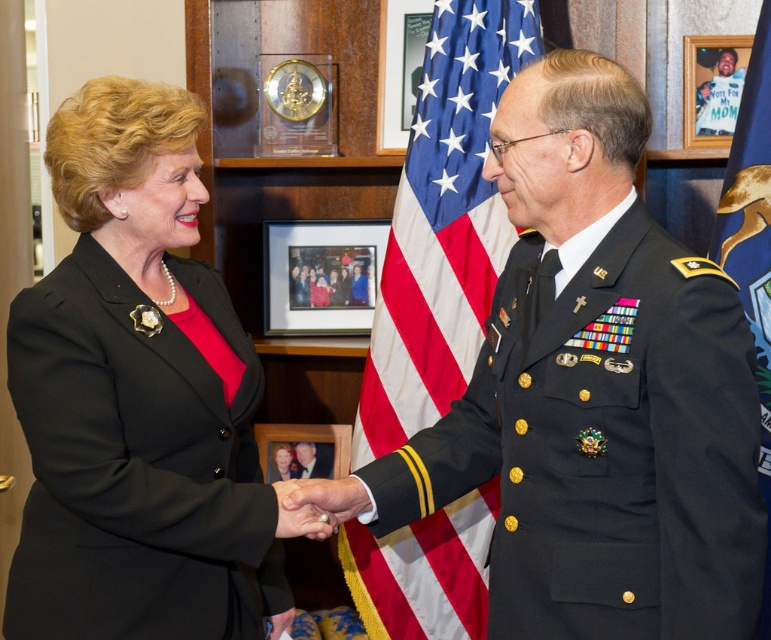
You are a photographer who needs to capture a closeup of the blue fabric flag at right. Based on the scene description, where should you position yourself to ensure the flag is in the frame?

The blue fabric flag at right is located at point (752,243), so you should position yourself to the right side of the scene to capture it in the frame.

You are a photographer adjusting your camera settings. You need to focus on two specific points in the image, point (x=514, y=67) and point (x=305, y=314). Which point should you adjust the focus for first if you want to capture the closest object to the camera?

Point (x=514, y=67) is closer to the camera than point (x=305, y=314), so you should focus on point (x=514, y=67) first to capture the closest object.

You are an event planner organizing a ceremony and need to place a new decorative item between the blue fabric flag at right and the wooden framed photo at center. Based on their current positions, which object should the new item be placed closer to?

The blue fabric flag at right is positioned on the right side of the wooden framed photo at center. Therefore, the new item should be placed closer to the wooden framed photo at center to maintain symmetry between the blue fabric flag at right and the wooden framed photo at center.